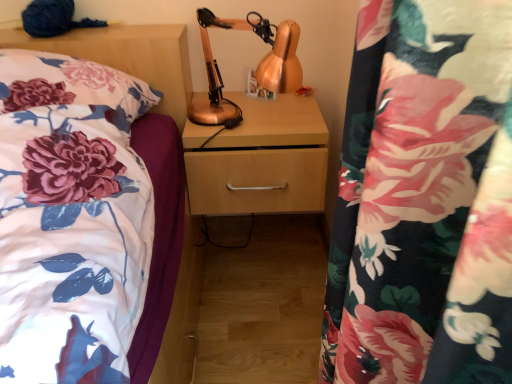
Question: Is copper metallic table lamp at center turned away from wooden drawer at center?

Choices:
 (A) no
 (B) yes

Answer: (A)

Question: Is copper metallic table lamp at center with wooden drawer at center?

Choices:
 (A) yes
 (B) no

Answer: (B)

Question: Is copper metallic table lamp at center smaller than wooden drawer at center?

Choices:
 (A) no
 (B) yes

Answer: (B)

Question: Is the depth of copper metallic table lamp at center greater than that of wooden drawer at center?

Choices:
 (A) yes
 (B) no

Answer: (B)

Question: Is copper metallic table lamp at center at the left side of wooden drawer at center?

Choices:
 (A) no
 (B) yes

Answer: (B)

Question: From a real-world perspective, is wooden drawer at center above or below copper metallic table lamp at center?

Choices:
 (A) below
 (B) above

Answer: (A)

Question: Considering the positions of wooden drawer at center and copper metallic table lamp at center in the image, is wooden drawer at center taller or shorter than copper metallic table lamp at center?

Choices:
 (A) short
 (B) tall

Answer: (A)

Question: From the image's perspective, is wooden drawer at center positioned above or below copper metallic table lamp at center?

Choices:
 (A) above
 (B) below

Answer: (B)

Question: Is wooden drawer at center in front of or behind copper metallic table lamp at center in the image?

Choices:
 (A) behind
 (B) front

Answer: (A)

Question: From a real-world perspective, is copper metallic table lamp at center above or below floral fabric pillow at left?

Choices:
 (A) below
 (B) above

Answer: (B)

Question: Considering the positions of point (198, 16) and point (18, 66), is point (198, 16) closer or farther from the camera than point (18, 66)?

Choices:
 (A) farther
 (B) closer

Answer: (A)

Question: Is copper metallic table lamp at center situated inside floral fabric pillow at left or outside?

Choices:
 (A) outside
 (B) inside

Answer: (A)

Question: Considering the relative positions of copper metallic table lamp at center and floral fabric pillow at left in the image provided, is copper metallic table lamp at center to the left or to the right of floral fabric pillow at left?

Choices:
 (A) right
 (B) left

Answer: (A)

Question: In terms of size, does floral fabric pillow at left appear bigger or smaller than wooden drawer at center?

Choices:
 (A) small
 (B) big

Answer: (B)

Question: Would you say floral fabric pillow at left is to the left or to the right of wooden drawer at center in the picture?

Choices:
 (A) right
 (B) left

Answer: (B)